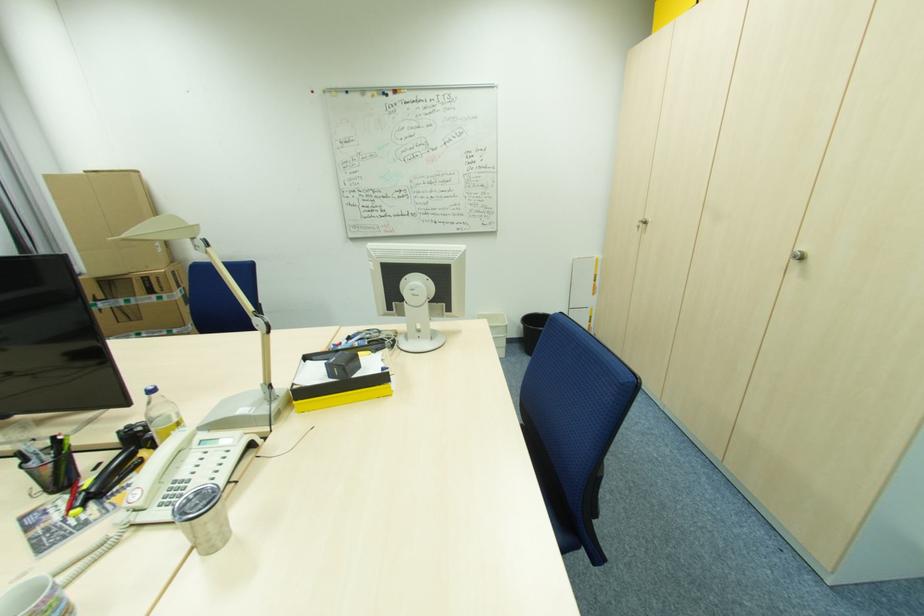
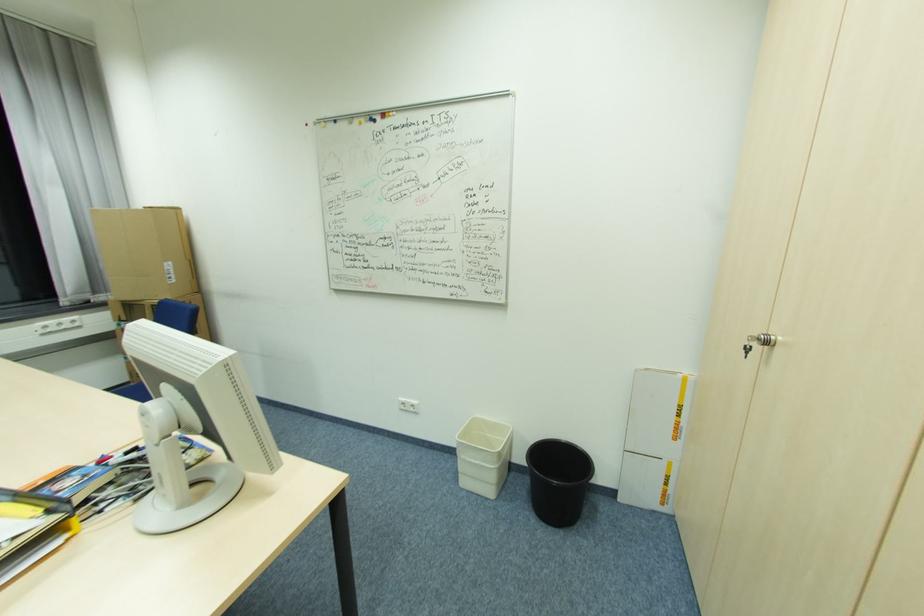
Locate, in the second image, the point that corresponds to (x=598, y=288) in the first image.

(681, 430)